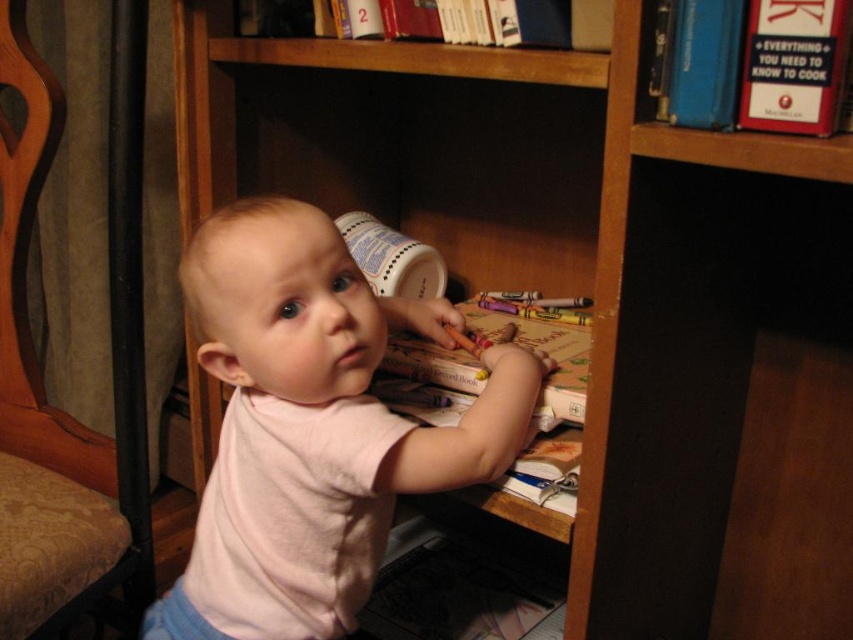
Does wooden armchair at left appear over hardcover book at upper right?

No, wooden armchair at left is not above hardcover book at upper right.

Is wooden armchair at left wider than hardcover book at upper right?

Yes, wooden armchair at left is wider than hardcover book at upper right.

Does point (143, 49) lie in front of point (776, 115)?

No, it is not.

Identify the location of wooden armchair at left. (39, 381).

Can you confirm if hardcover book at center is bigger than hardcover book at upper center?

Correct, hardcover book at center is larger in size than hardcover book at upper center.

Who is shorter, hardcover book at center or hardcover book at upper center?

With less height is hardcover book at upper center.

Is point (410, 390) closer to camera compared to point (325, 26)?

That is True.

You are a GUI agent. You are given a task and a screenshot of the screen. Output one action in this format:
    pyautogui.click(x=<x>, y=<y>)
    Task: Click on the hardcover book at center
    The width and height of the screenshot is (853, 640).
    Given the screenshot: What is the action you would take?
    click(544, 353)

Which is above, wooden armchair at left or hardcover book at center?

wooden armchair at left

Between wooden armchair at left and hardcover book at center, which one appears on the right side from the viewer's perspective?

Positioned to the right is hardcover book at center.

The height and width of the screenshot is (640, 853). Identify the location of wooden armchair at left. (39, 381).